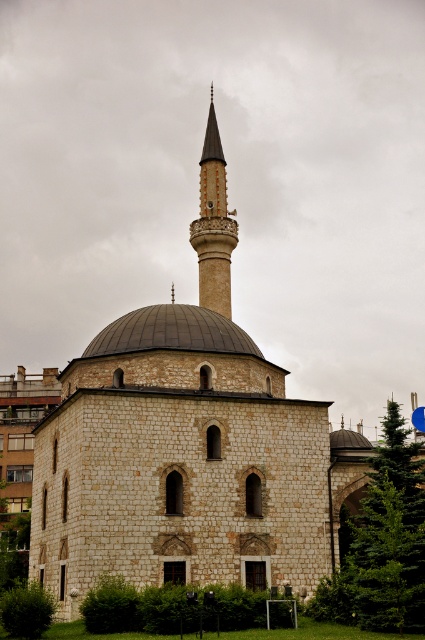
You are an architect examining the mosque structure. You need to determine the order in which the dark gray stone dome at center and the smooth beige minaret at upper center would appear when viewed from the front. Which one would you see first?

The dark gray stone dome at center is closer to the viewer than the smooth beige minaret at upper center, so the dark gray stone dome at center would be seen first when viewed from the front.

You are standing in front of a traditional mosque and want to take a photo of the dark gray stone dome at center. If your camera can focus on objects up to 200 feet away, will it be able to capture the dome clearly?

The dark gray stone dome at center is 203.82 feet away from the viewer, which is beyond the camera focus range of 200 feet. Therefore, the camera cannot capture the dome clearly.

You are a tourist standing in front of the mosque and want to take a photo of the dark gray stone dome at center and the smooth beige minaret at upper center. Which object should you focus on first if you want to capture both in a single frame without moving the camera?

The dark gray stone dome at center is positioned under the smooth beige minaret at upper center, so you should focus on the smooth beige minaret at upper center first to ensure both are in the frame.